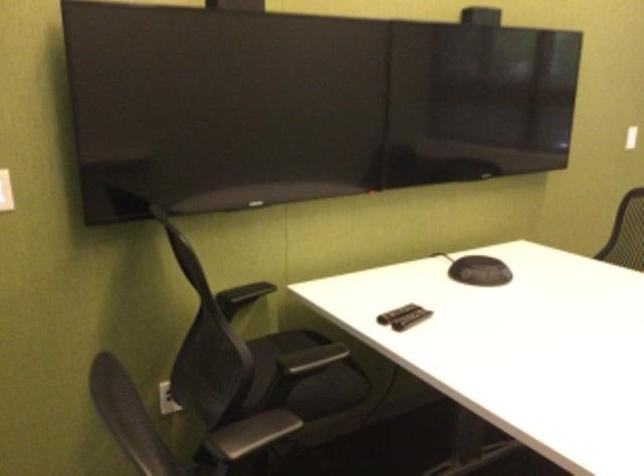
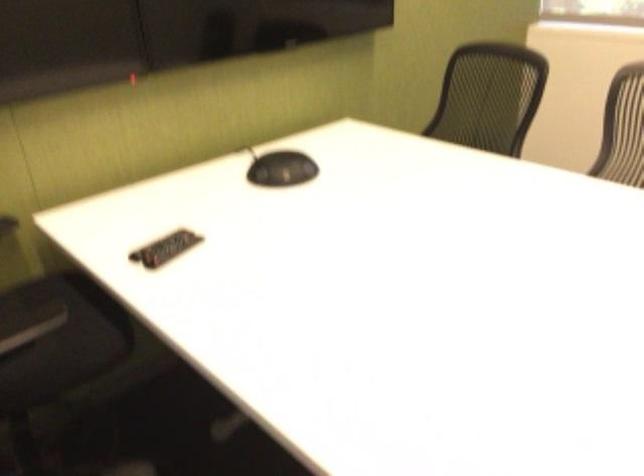
Find the pixel in the second image that matches [489,270] in the first image.

(281, 169)